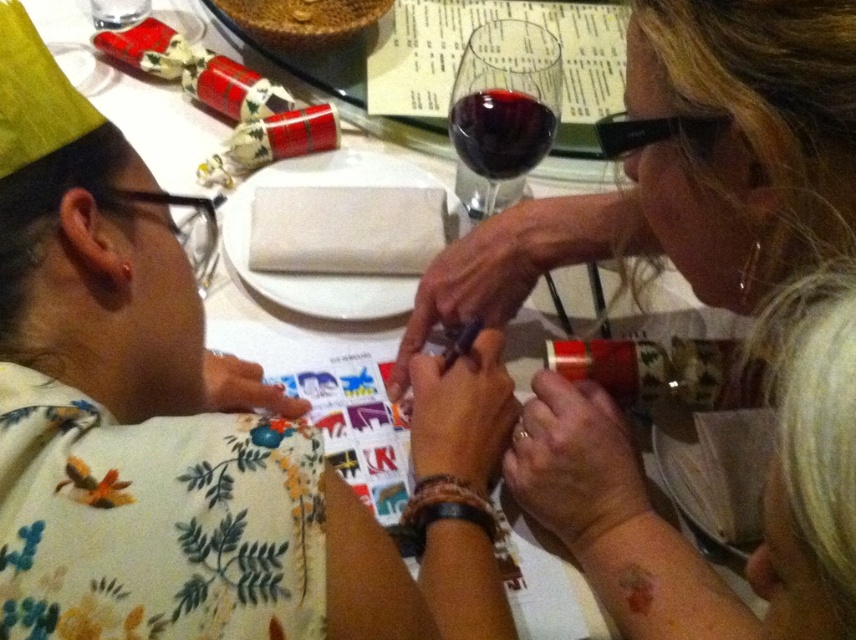
You are standing at the point marked as point (498, 76). You want to reach the door located at the opposite side of the room. There is a small table 10 inches wide in your path. Can you walk straight to the door without stepping on the table?

The distance between you and the door is 25.27 inches. Since the table is only 10 inches wide, there is enough space to walk around it and reach the door without stepping on the table.

You are at the gathering and want to move from the point at coordinates point (504, 83) to the point at coordinates point (507, 100). Can you walk directly between these two points without any obstacles?

Point (504, 83) is behind point (507, 100), so you cannot walk directly between them as the first point is located behind the second one.

You are a bartender preparing drinks for a party. You need to choose between the dark red glass at upper center and the black plastic glasses at upper right for a drink that requires a taller container. Which one should you choose?

The dark red glass at upper center is taller than the black plastic glasses at upper right, so you should choose the dark red glass at upper center for the drink that requires a taller container.